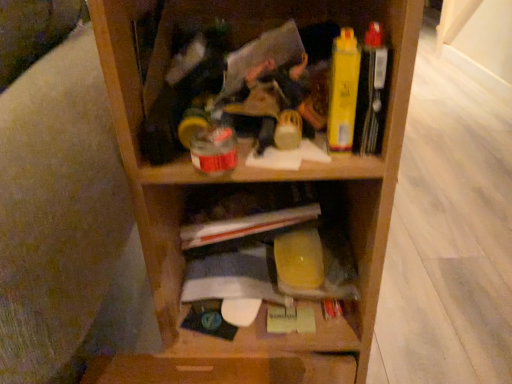
Question: Are yellow plastic container at center and yellow matte book at upper right far apart?

Choices:
 (A) yes
 (B) no

Answer: (B)

Question: Is yellow plastic container at center facing away from yellow matte book at upper right?

Choices:
 (A) no
 (B) yes

Answer: (A)

Question: From the image's perspective, is yellow plastic container at center under yellow matte book at upper right?

Choices:
 (A) no
 (B) yes

Answer: (B)

Question: From a real-world perspective, is yellow plastic container at center positioned over yellow matte book at upper right based on gravity?

Choices:
 (A) no
 (B) yes

Answer: (A)

Question: Does yellow plastic container at center appear on the right side of yellow matte book at upper right?

Choices:
 (A) yes
 (B) no

Answer: (B)

Question: Would you say yellow plastic container at center is inside or outside yellow matte book at upper right?

Choices:
 (A) outside
 (B) inside

Answer: (A)

Question: Considering their positions, is yellow plastic container at center located in front of or behind yellow matte book at upper right?

Choices:
 (A) front
 (B) behind

Answer: (B)

Question: Is point (326, 342) closer or farther from the camera than point (373, 114)?

Choices:
 (A) closer
 (B) farther

Answer: (B)

Question: From the image's perspective, is yellow plastic container at center above or below yellow matte book at upper right?

Choices:
 (A) above
 (B) below

Answer: (B)

Question: Relative to yellow plastic container at center, is wooden shelf at center in front or behind?

Choices:
 (A) behind
 (B) front

Answer: (B)

Question: From their relative heights in the image, would you say wooden shelf at center is taller or shorter than yellow plastic container at center?

Choices:
 (A) short
 (B) tall

Answer: (B)

Question: From the image's perspective, is wooden shelf at center located above or below yellow plastic container at center?

Choices:
 (A) above
 (B) below

Answer: (A)

Question: In terms of width, does wooden shelf at center look wider or thinner when compared to yellow plastic container at center?

Choices:
 (A) thin
 (B) wide

Answer: (B)

Question: Is yellow plastic container at center in front of or behind wooden shelf at center in the image?

Choices:
 (A) behind
 (B) front

Answer: (A)

Question: Looking at the image, does yellow plastic container at center seem bigger or smaller compared to wooden shelf at center?

Choices:
 (A) big
 (B) small

Answer: (B)